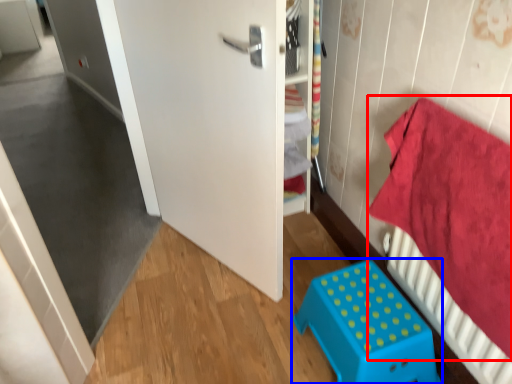
Question: Which object appears closest to the camera in this image, bedding (highlighted by a red box) or furniture (highlighted by a blue box)?

Choices:
 (A) bedding
 (B) furniture

Answer: (A)